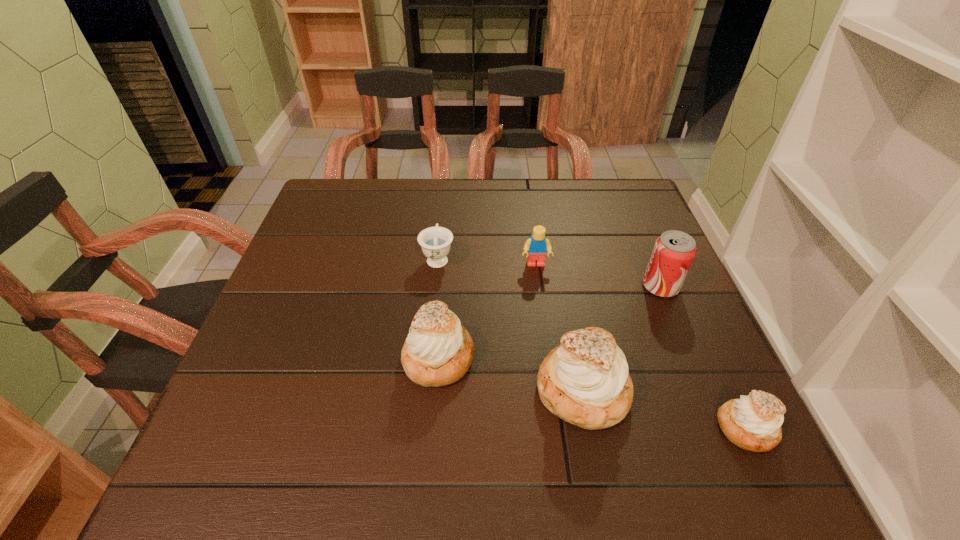
The height and width of the screenshot is (540, 960). Identify the location of the second shortest pastry. (438, 351).

The image size is (960, 540). Find the location of `the second pastry from right to left`. the second pastry from right to left is located at coordinates (584, 381).

Where is `the rightmost pastry`? the rightmost pastry is located at coordinates (753, 422).

Where is `teacup`? The height and width of the screenshot is (540, 960). teacup is located at coordinates (435, 242).

Identify the location of the fourth tallest object. Image resolution: width=960 pixels, height=540 pixels. (537, 245).

You are a GUI agent. You are given a task and a screenshot of the screen. Output one action in this format:
    pyautogui.click(x=<x>, y=<y>)
    Task: Click on the soda can
    This screenshot has height=540, width=960.
    Given the screenshot: What is the action you would take?
    (674, 251)

The width and height of the screenshot is (960, 540). Find the location of `vacant region located on the front of the leftmost pastry`. vacant region located on the front of the leftmost pastry is located at coordinates (434, 414).

The width and height of the screenshot is (960, 540). I want to click on vacant region located 0.190m on the left of the second pastry from left to right, so click(436, 390).

This screenshot has height=540, width=960. What are the coordinates of `vacant space situated 0.180m on the left of the shortest pastry` in the screenshot? It's located at (616, 428).

Locate an element on the screen. The image size is (960, 540). vacant space situated 0.320m on the side of the teacup with the handle is located at coordinates (446, 178).